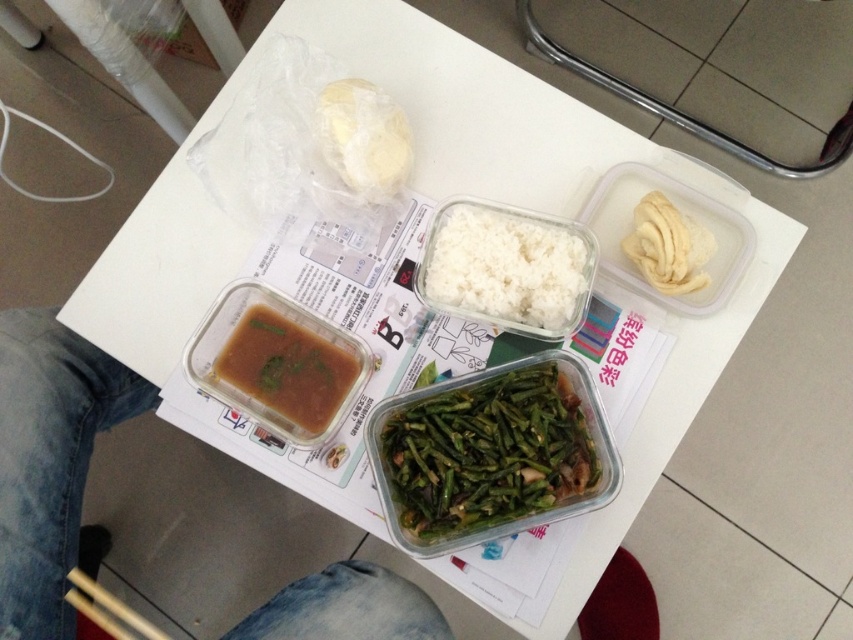
Can you confirm if brown translucent soup at center is smaller than wooden chopsticks at lower left?

Indeed, brown translucent soup at center has a smaller size compared to wooden chopsticks at lower left.

Does brown translucent soup at center appear over wooden chopsticks at lower left?

Indeed, brown translucent soup at center is positioned over wooden chopsticks at lower left.

This screenshot has width=853, height=640. Describe the element at coordinates (287, 369) in the screenshot. I see `brown translucent soup at center` at that location.

This screenshot has height=640, width=853. Identify the location of brown translucent soup at center. (287, 369).

Does denim pants at lower left come behind green glossy string beans at center?

That is False.

Is point (45, 352) in front of point (532, 493)?

No, it is not.

This screenshot has height=640, width=853. I want to click on denim pants at lower left, so click(49, 460).

Describe the element at coordinates (364, 138) in the screenshot. I see `white matte doughnut at upper center` at that location.

Is point (407, 173) positioned behind point (86, 596)?

No, it is not.

At what (x,y) coordinates should I click in order to perform the action: click on white matte doughnut at upper center. Please return your answer as a coordinate pair (x, y). This screenshot has width=853, height=640. Looking at the image, I should click on (364, 138).